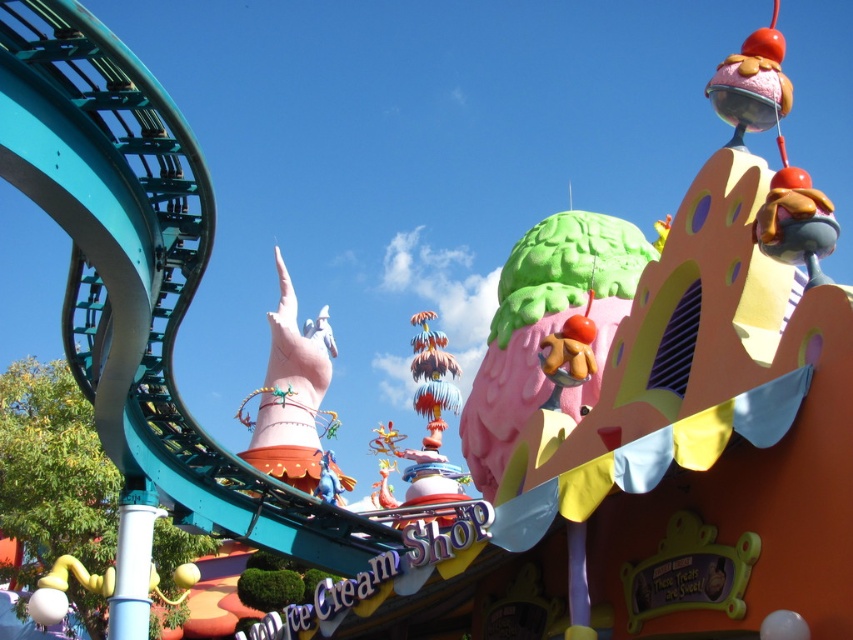
Can you confirm if green matte ice cream cone at upper center is thinner than pink matte hand at center?

Correct, green matte ice cream cone at upper center's width is less than pink matte hand at center's.

Which is more to the left, green matte ice cream cone at upper center or pink matte hand at center?

pink matte hand at center

Who is more forward, (502,394) or (308,440)?

Point (502,394)

You are a GUI agent. You are given a task and a screenshot of the screen. Output one action in this format:
    pyautogui.click(x=<x>, y=<y>)
    Task: Click on the green matte ice cream cone at upper center
    The image size is (853, 640).
    Given the screenshot: What is the action you would take?
    pyautogui.click(x=547, y=326)